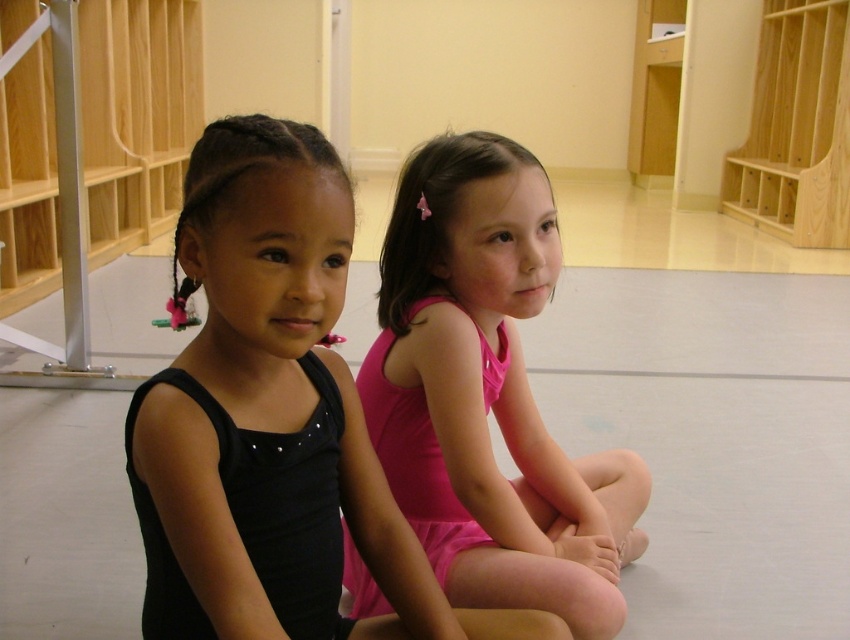
You are a photographer setting up a shot in the dance studio. You need to place two markers at coordinates point (180, 246) and point (457, 243). Which marker should you place first if you want to start from the closest point to the camera?

You should place the marker at point (180, 246) first because it is closer to the viewer than point (457, 243).

You are a photographer setting up for a dance class photo shoot. You need to position a spotlight exactly at point (272, 419). According to the scene description, what object will the spotlight illuminate?

The point (272, 419) indicates the black matte leotard at left, so the spotlight will illuminate the black matte leotard at left.